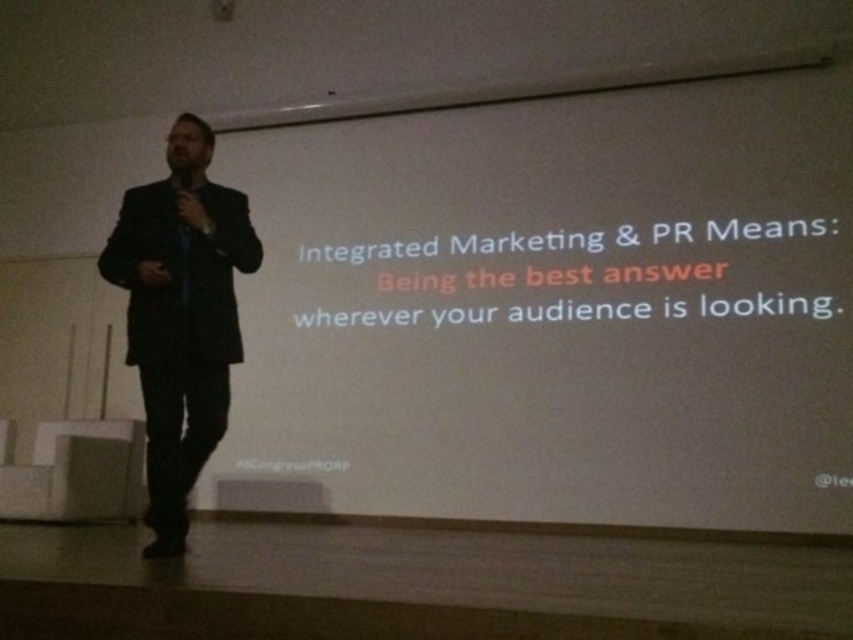
You are a stagehand who needs to adjust the distance between the dark suit at left and the black matte microphone at left to at least 16 inches for safety. Can you do it without moving the microphone?

The dark suit at left is currently 14.90 inches away from the black matte microphone at left. To meet the safety requirement of at least 16 inches, you would need to move the dark suit at left further away from the microphone. However, since the dark suit is part of the presenter, moving it would require the presenter to adjust his position. If you cannot move the microphone, you would need to ask the presenter to step back to increase the distance.

You are an event planner observing the stage setup. You need to ensure that the dark suit at left and the black matte microphone at left are positioned so that the microphone is visible to the audience. Based on their current positions, is the microphone likely visible to the audience?

The dark suit at left is to the left of black matte microphone at left, so the microphone is positioned to the right of the dark suit. Since the man is holding the microphone in his right hand, it is likely visible to the audience as it is positioned to his right side, away from his body.

You are an event organizer checking the stage setup. You see the dark suit at left and the black matte microphone at left. Which object is wider?

The dark suit at left is wider than the black matte microphone at left.